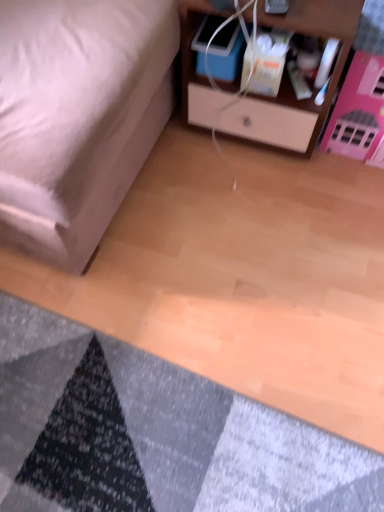
Question: Is wooden nightstand at upper right in contact with matte white bed at lower left?

Choices:
 (A) no
 (B) yes

Answer: (A)

Question: From a real-world perspective, is wooden nightstand at upper right below matte white bed at lower left?

Choices:
 (A) no
 (B) yes

Answer: (B)

Question: Can you confirm if wooden nightstand at upper right is thinner than matte white bed at lower left?

Choices:
 (A) no
 (B) yes

Answer: (B)

Question: Is wooden nightstand at upper right facing away from matte white bed at lower left?

Choices:
 (A) no
 (B) yes

Answer: (A)

Question: Considering the relative positions of wooden nightstand at upper right and matte white bed at lower left in the image provided, is wooden nightstand at upper right behind matte white bed at lower left?

Choices:
 (A) yes
 (B) no

Answer: (A)

Question: Would you say wooden nightstand at upper right contains matte white bed at lower left?

Choices:
 (A) yes
 (B) no

Answer: (B)

Question: Is textured gray mat at lower left in contact with matte white bed at lower left?

Choices:
 (A) no
 (B) yes

Answer: (A)

Question: Considering the relative positions of textured gray mat at lower left and matte white bed at lower left in the image provided, is textured gray mat at lower left to the left of matte white bed at lower left from the viewer's perspective?

Choices:
 (A) yes
 (B) no

Answer: (B)

Question: From a real-world perspective, is textured gray mat at lower left physically below matte white bed at lower left?

Choices:
 (A) no
 (B) yes

Answer: (B)

Question: Is textured gray mat at lower left further to camera compared to matte white bed at lower left?

Choices:
 (A) yes
 (B) no

Answer: (A)

Question: Would you say matte white bed at lower left is part of textured gray mat at lower left's contents?

Choices:
 (A) yes
 (B) no

Answer: (B)

Question: Considering the relative sizes of textured gray mat at lower left and matte white bed at lower left in the image provided, is textured gray mat at lower left wider than matte white bed at lower left?

Choices:
 (A) no
 (B) yes

Answer: (A)

Question: From the image's perspective, does wooden nightstand at upper right appear lower than textured gray mat at lower left?

Choices:
 (A) no
 (B) yes

Answer: (A)